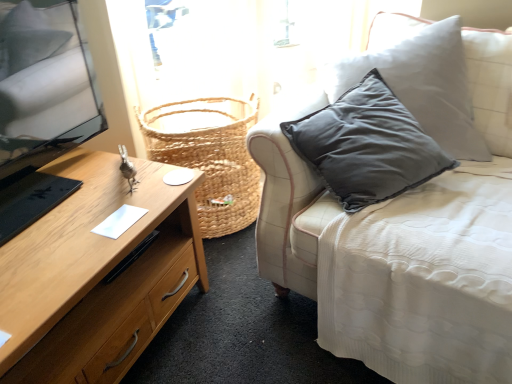
Question: Does wooden desk at left have a greater height compared to white fabric couch at center?

Choices:
 (A) no
 (B) yes

Answer: (A)

Question: Can you confirm if wooden desk at left is smaller than white fabric couch at center?

Choices:
 (A) yes
 (B) no

Answer: (A)

Question: Could you tell me if wooden desk at left is facing white fabric couch at center?

Choices:
 (A) yes
 (B) no

Answer: (B)

Question: Does wooden desk at left have a lesser height compared to white fabric couch at center?

Choices:
 (A) no
 (B) yes

Answer: (B)

Question: Can you confirm if wooden desk at left is positioned to the right of white fabric couch at center?

Choices:
 (A) no
 (B) yes

Answer: (A)

Question: Can you confirm if wooden desk at left is positioned to the left of white fabric couch at center?

Choices:
 (A) no
 (B) yes

Answer: (B)

Question: Considering the relative sizes of wooden desk at left and woven natural basket at center in the image provided, is wooden desk at left smaller than woven natural basket at center?

Choices:
 (A) no
 (B) yes

Answer: (A)

Question: From a real-world perspective, is wooden desk at left located higher than woven natural basket at center?

Choices:
 (A) yes
 (B) no

Answer: (B)

Question: Is wooden desk at left aimed at woven natural basket at center?

Choices:
 (A) no
 (B) yes

Answer: (A)

Question: Is wooden desk at left far from woven natural basket at center?

Choices:
 (A) yes
 (B) no

Answer: (B)

Question: Does wooden desk at left appear on the left side of woven natural basket at center?

Choices:
 (A) yes
 (B) no

Answer: (A)

Question: Is wooden desk at left thinner than woven natural basket at center?

Choices:
 (A) yes
 (B) no

Answer: (B)

Question: From a real-world perspective, is woven natural basket at center on top of wooden desk at left?

Choices:
 (A) no
 (B) yes

Answer: (B)